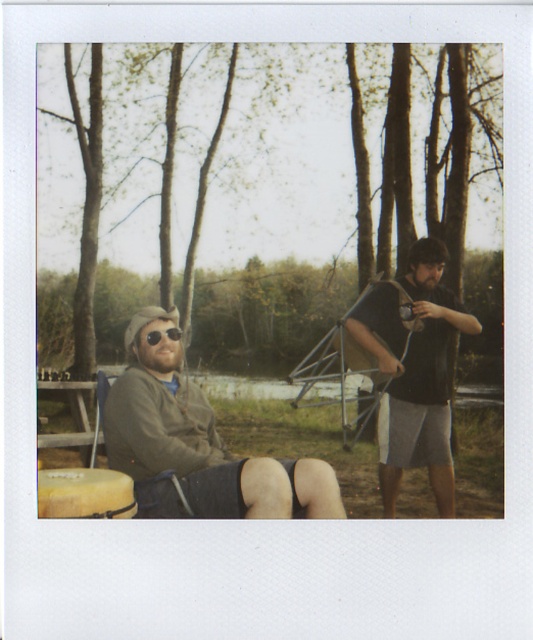
Is matte black shirt at right bigger than wooden picnic table at lower left?

Indeed, matte black shirt at right has a larger size compared to wooden picnic table at lower left.

Is point (387, 321) positioned after point (75, 435)?

No, (387, 321) is closer to viewer.

The width and height of the screenshot is (533, 640). Identify the location of matte black shirt at right. (415, 372).

Does matte gray jacket at left appear on the right side of matte black shirt at right?

In fact, matte gray jacket at left is to the left of matte black shirt at right.

What do you see at coordinates (197, 444) in the screenshot? I see `matte gray jacket at left` at bounding box center [197, 444].

Where is `matte gray jacket at left`? This screenshot has height=640, width=533. matte gray jacket at left is located at coordinates (197, 444).

Find the location of `matte gray jacket at left`. matte gray jacket at left is located at coordinates point(197,444).

Between matte gray jacket at left and wooden picnic table at lower left, which one has less height?

wooden picnic table at lower left

Is the position of matte gray jacket at left less distant than that of wooden picnic table at lower left?

Yes, it is in front of wooden picnic table at lower left.

I want to click on matte gray jacket at left, so click(197, 444).

Find the location of a particular element. This screenshot has height=640, width=533. matte gray jacket at left is located at coordinates (197, 444).